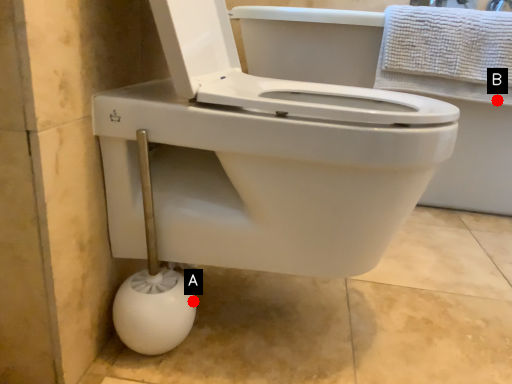
Question: Two points are circled on the image, labeled by A and B beside each circle. Which of the following is the closest to the observer?

Choices:
 (A) A is closer
 (B) B is closer

Answer: (A)